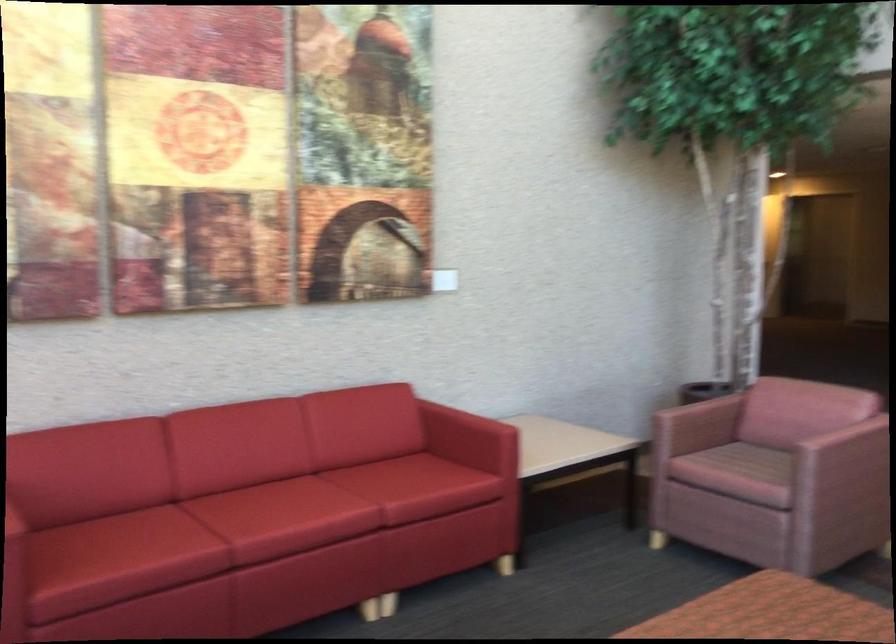
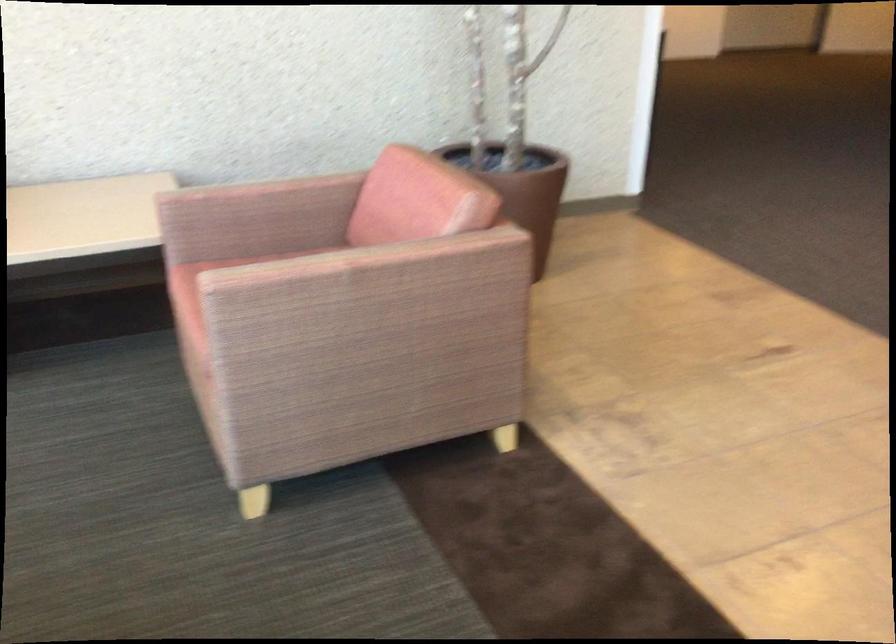
In a continuous first-person perspective shot, in which direction is the camera moving?

The cameraman moved toward right, forward.